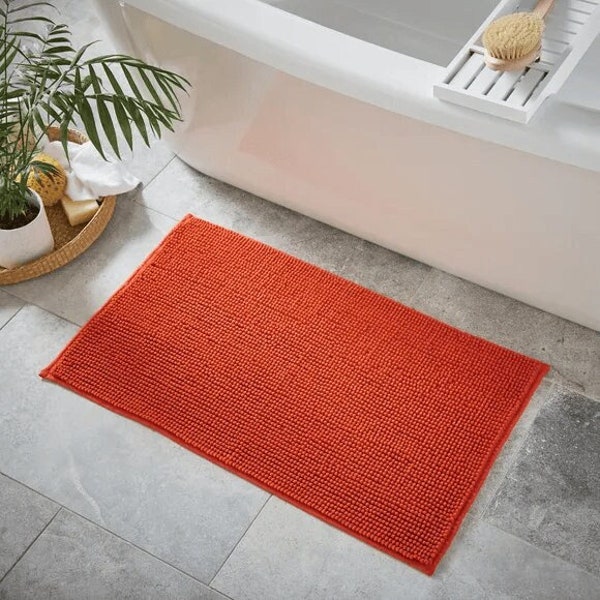
You are a GUI agent. You are given a task and a screenshot of the screen. Output one action in this format:
    pyautogui.click(x=<x>, y=<y>)
    Task: Click on the white planter
    
    Given the screenshot: What is the action you would take?
    pyautogui.click(x=37, y=234)